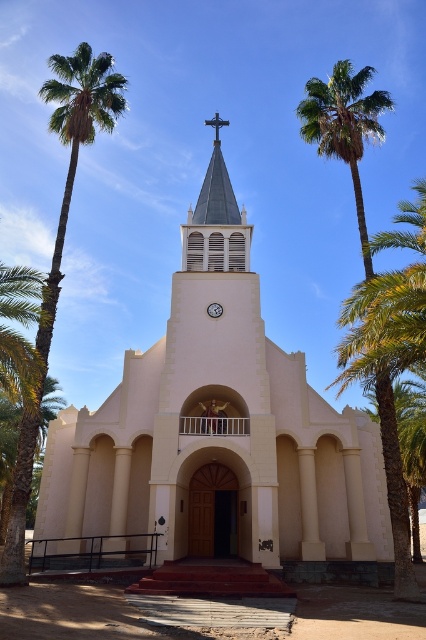
Is point (333, 536) closer to camera compared to point (112, 124)?

No, it is behind (112, 124).

Can you confirm if white smooth church at center is positioned to the right of green leafy palm tree at left?

Indeed, white smooth church at center is positioned on the right side of green leafy palm tree at left.

This screenshot has width=426, height=640. I want to click on white smooth church at center, so click(218, 436).

Where is `white smooth church at center`? white smooth church at center is located at coordinates (218, 436).

Which is more to the left, white smooth church at center or green leafy palm tree at upper right?

Positioned to the left is white smooth church at center.

Locate an element on the screen. This screenshot has height=640, width=426. white smooth church at center is located at coordinates (218, 436).

Which is behind, point (180, 525) or point (299, 102)?

Point (299, 102)

Locate an element on the screen. The image size is (426, 640). white smooth church at center is located at coordinates (218, 436).

Describe the element at coordinates (58, 248) in the screenshot. The width and height of the screenshot is (426, 640). I see `green leafy palm tree at left` at that location.

Locate an element on the screen. This screenshot has height=640, width=426. green leafy palm tree at left is located at coordinates (58, 248).

Does point (11, 547) lie behind point (212, 307)?

No, (11, 547) is closer to viewer.

Locate an element on the screen. green leafy palm tree at left is located at coordinates (58, 248).